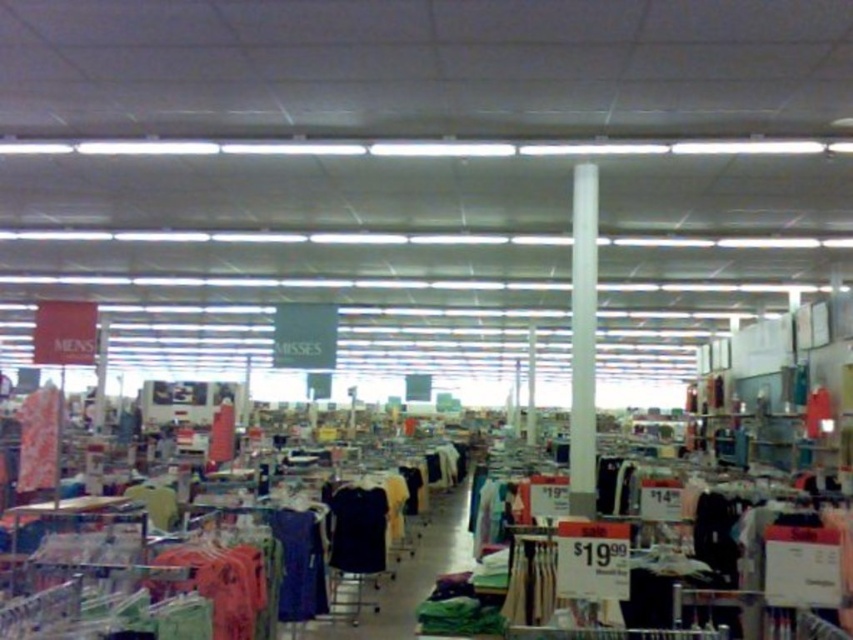
Which of these two, dark blue fabric dress at center or striped fabric shirt at left, stands shorter?

With less height is striped fabric shirt at left.

Which is above, dark blue fabric dress at center or striped fabric shirt at left?

striped fabric shirt at left is higher up.

Does point (289, 522) lie behind point (32, 403)?

Yes, it is behind point (32, 403).

Identify the location of dark blue fabric dress at center. (299, 564).

Can you confirm if dark blue fabric shirt at center is smaller than striped fabric shirt at left?

No.

Which of these two, dark blue fabric shirt at center or striped fabric shirt at left, stands taller?

Standing taller between the two is dark blue fabric shirt at center.

Find the location of `dark blue fabric shirt at center`. dark blue fabric shirt at center is located at coordinates (358, 529).

Find the location of a particular element. The width and height of the screenshot is (853, 640). dark blue fabric shirt at center is located at coordinates (358, 529).

Is dark blue fabric dress at center closer to the viewer compared to dark blue fabric shirt at center?

Yes, it is.

Is point (309, 548) farther from camera compared to point (347, 566)?

No, it is not.

Where is `dark blue fabric dress at center`? dark blue fabric dress at center is located at coordinates (299, 564).